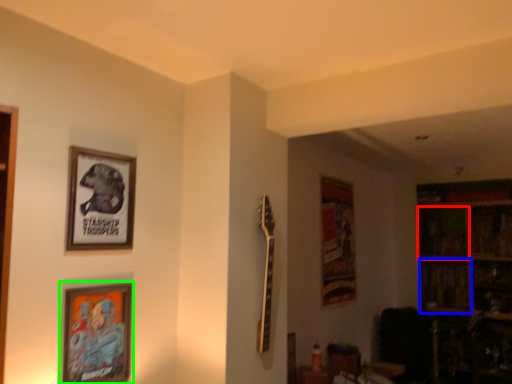
Question: Based on their relative distances, which object is nearer to shelf (highlighted by a red box)? Choose from shelf (highlighted by a blue box) and picture frame (highlighted by a green box).

Choices:
 (A) shelf
 (B) picture frame

Answer: (A)